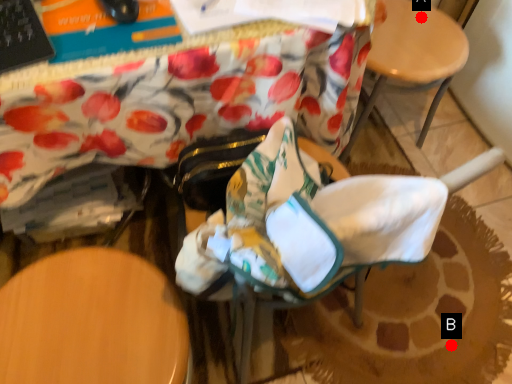
Question: Two points are circled on the image, labeled by A and B beside each circle. Which point appears closest to the camera in this image?

Choices:
 (A) A is closer
 (B) B is closer

Answer: (B)